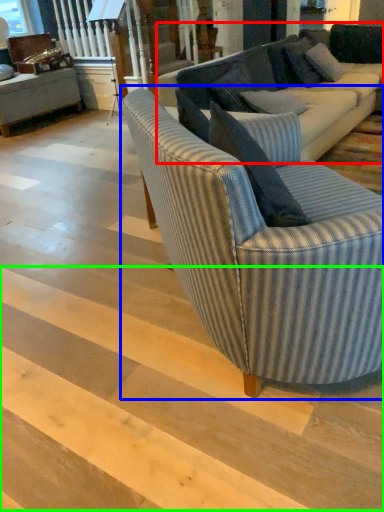
Question: Estimate the real-world distances between objects in this image. Which object is farther from studio couch (highlighted by a red box), studio couch (highlighted by a blue box) or stairwell (highlighted by a green box)?

Choices:
 (A) studio couch
 (B) stairwell

Answer: (B)